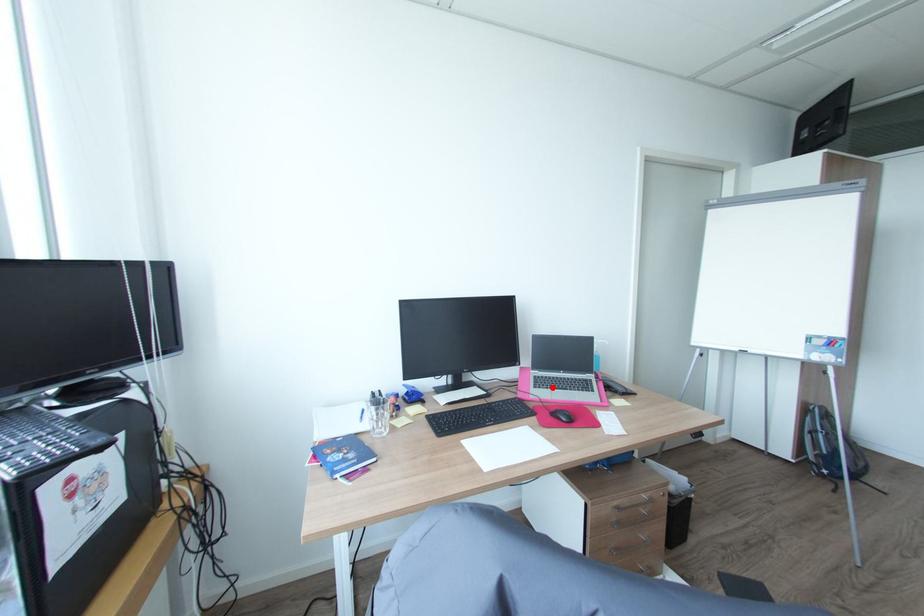
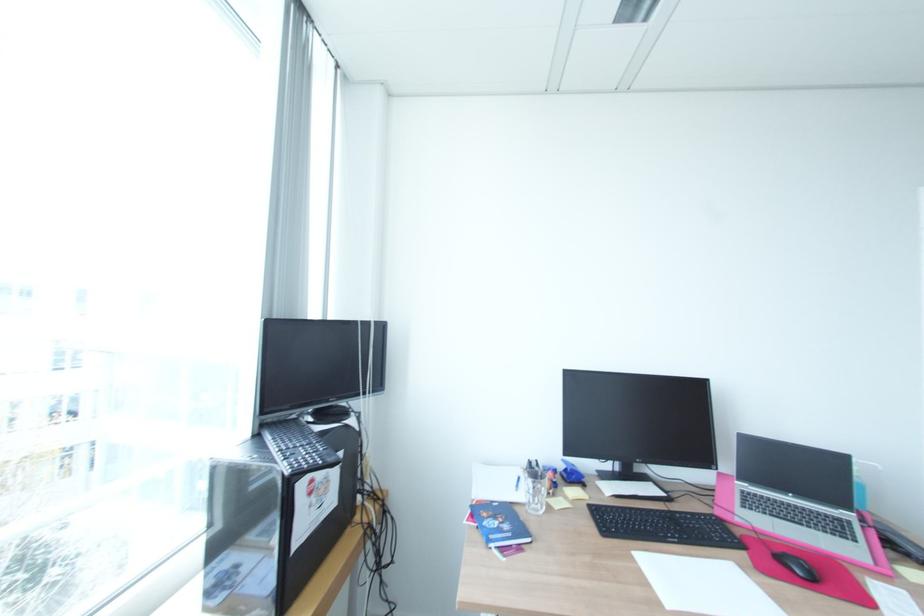
Where in the second image is the point corresponding to the highlighted location from the first image?

(770, 513)